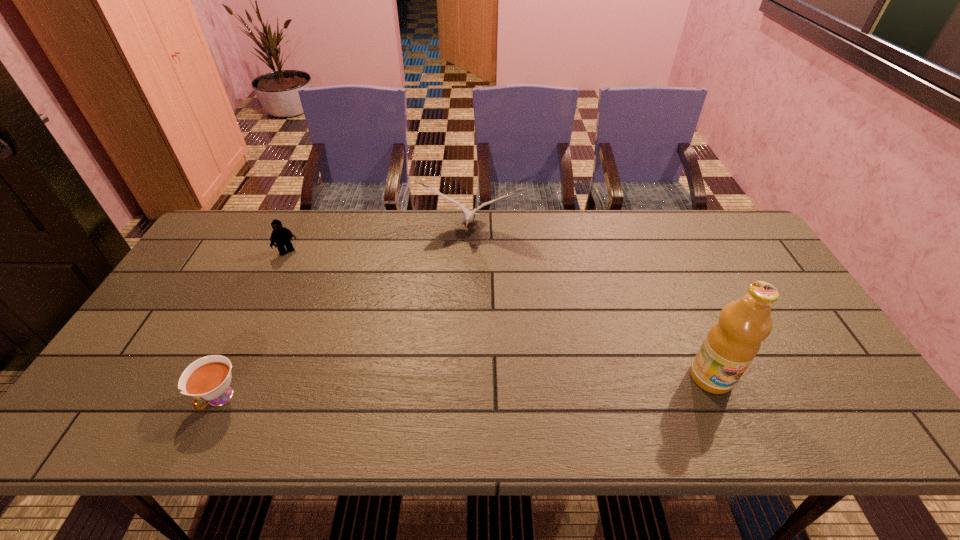
The height and width of the screenshot is (540, 960). In order to click on free location at the far right corner of the desktop in this screenshot , I will do `click(753, 244)`.

This screenshot has height=540, width=960. Find the location of `free space between the Lego and the third shortest object`. free space between the Lego and the third shortest object is located at coordinates click(x=378, y=241).

Find the location of a particular element. vacant space that's between the Lego and the third object from left to right is located at coordinates (378, 241).

What are the coordinates of `unoccupied area between the second object from right to left and the olive oil` in the screenshot? It's located at (590, 304).

At what (x,y) coordinates should I click in order to perform the action: click on free space between the third shortest object and the olive oil. Please return your answer as a coordinate pair (x, y). This screenshot has width=960, height=540. Looking at the image, I should click on (590, 304).

The height and width of the screenshot is (540, 960). What are the coordinates of `vacant space in between the Lego and the rightmost object` in the screenshot? It's located at (499, 314).

You are a GUI agent. You are given a task and a screenshot of the screen. Output one action in this format:
    pyautogui.click(x=<x>, y=<y>)
    Task: Click on the free area in between the third tallest object and the second object from right to left
    This screenshot has width=960, height=540.
    Given the screenshot: What is the action you would take?
    pyautogui.click(x=378, y=241)

Where is `vacant area between the teacup and the second shortest object`? The height and width of the screenshot is (540, 960). vacant area between the teacup and the second shortest object is located at coordinates (253, 325).

At what (x,y) coordinates should I click in order to perform the action: click on unoccupied area between the third tallest object and the rightmost object. Please return your answer as a coordinate pair (x, y). Looking at the image, I should click on (499, 314).

At what (x,y) coordinates should I click in order to perform the action: click on vacant area that lies between the rightmost object and the shortest object. Please return your answer as a coordinate pair (x, y). This screenshot has height=540, width=960. Looking at the image, I should click on (466, 388).